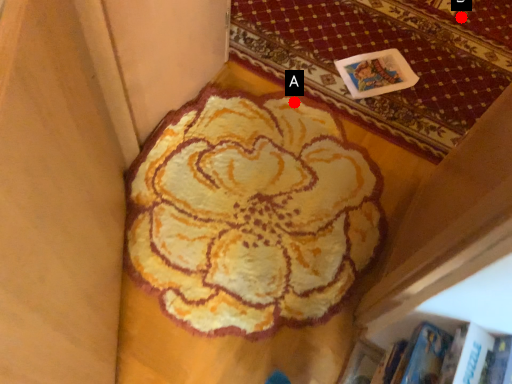
Question: Two points are circled on the image, labeled by A and B beside each circle. Which of the following is the closest to the observer?

Choices:
 (A) A is closer
 (B) B is closer

Answer: (A)